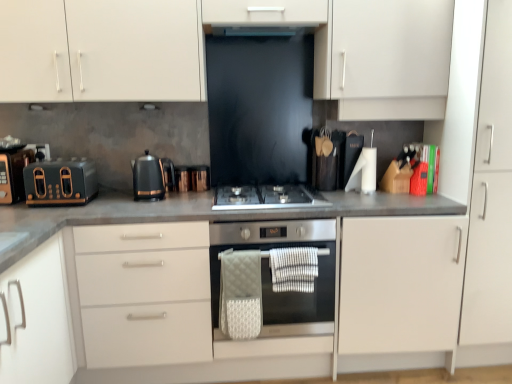
Where is `free location in front of black metallic kettle at center, positioned as the first kitchen appliance in right-to-left order`? free location in front of black metallic kettle at center, positioned as the first kitchen appliance in right-to-left order is located at coordinates (144, 210).